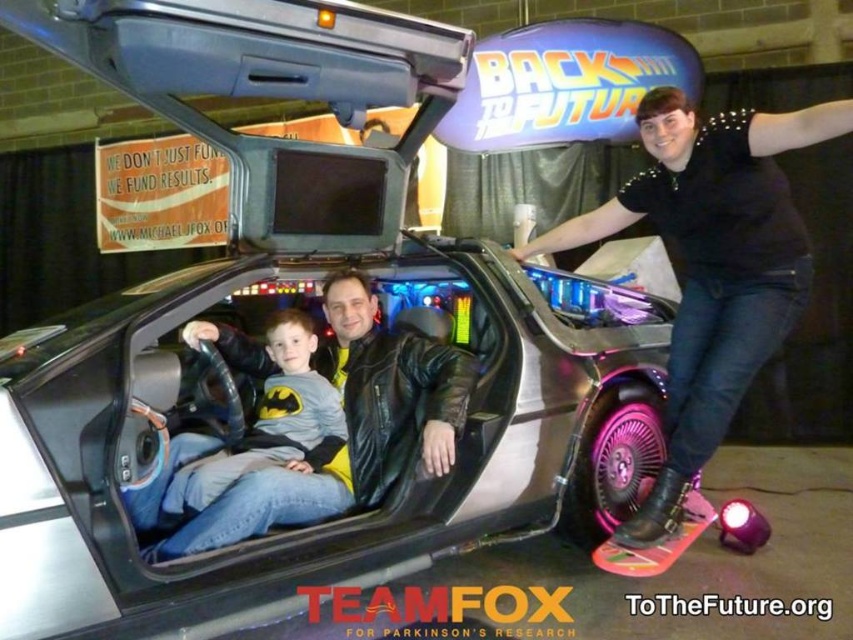
Who is higher up, black leather jacket at upper right or matte gray shirt at center?

black leather jacket at upper right

Does black leather jacket at upper right have a larger size compared to matte gray shirt at center?

Indeed, black leather jacket at upper right has a larger size compared to matte gray shirt at center.

What do you see at coordinates (711, 266) in the screenshot? This screenshot has width=853, height=640. I see `black leather jacket at upper right` at bounding box center [711, 266].

I want to click on black leather jacket at upper right, so click(x=711, y=266).

Can you confirm if matte gray shirt at center is smaller than leather jacket at center?

Indeed, matte gray shirt at center has a smaller size compared to leather jacket at center.

Between point (267, 406) and point (433, 352), which one is positioned behind?

The point (267, 406) is behind.

Locate an element on the screen. This screenshot has height=640, width=853. matte gray shirt at center is located at coordinates (265, 448).

I want to click on matte gray shirt at center, so click(265, 448).

Does black leather jacket at upper right appear under leather jacket at center?

No, black leather jacket at upper right is not below leather jacket at center.

Based on the photo, who is more distant from viewer, (718, 336) or (421, 372)?

The point (421, 372) is more distant.

Does point (640, 200) come closer to viewer compared to point (358, 292)?

No, it is behind (358, 292).

At what (x,y) coordinates should I click in order to perform the action: click on black leather jacket at upper right. Please return your answer as a coordinate pair (x, y). The height and width of the screenshot is (640, 853). Looking at the image, I should click on (711, 266).